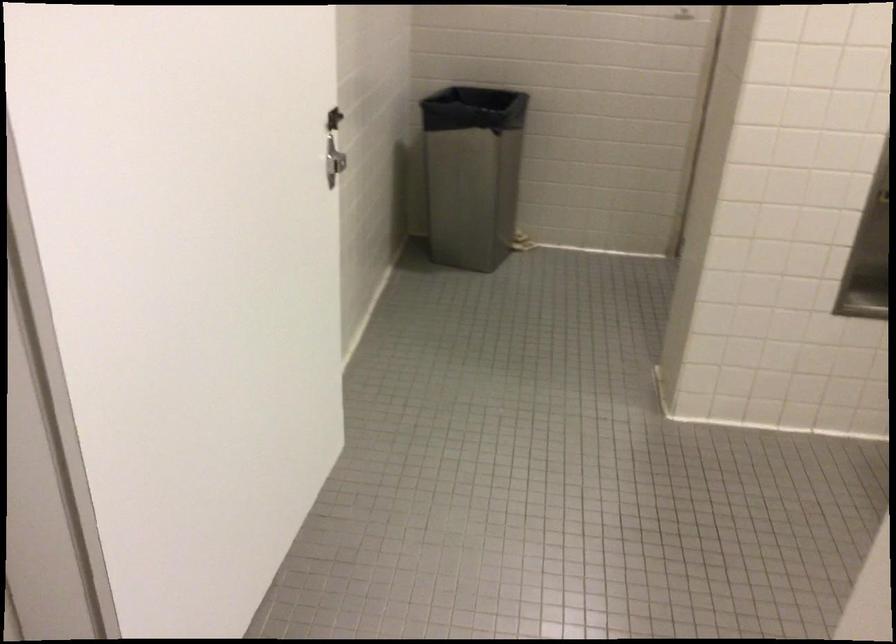
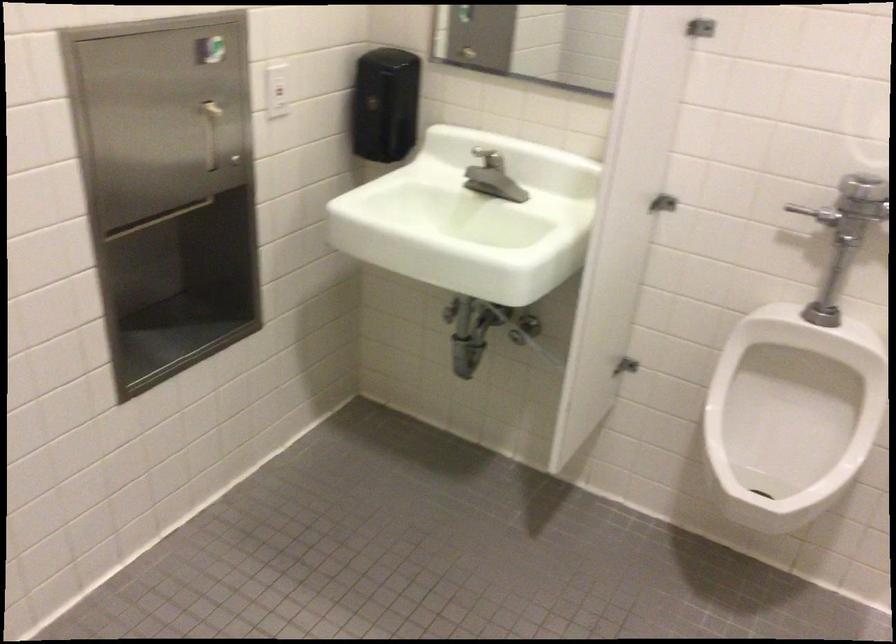
Based on the continuous images, in which direction is the camera rotating?

The camera rotated toward right-down.